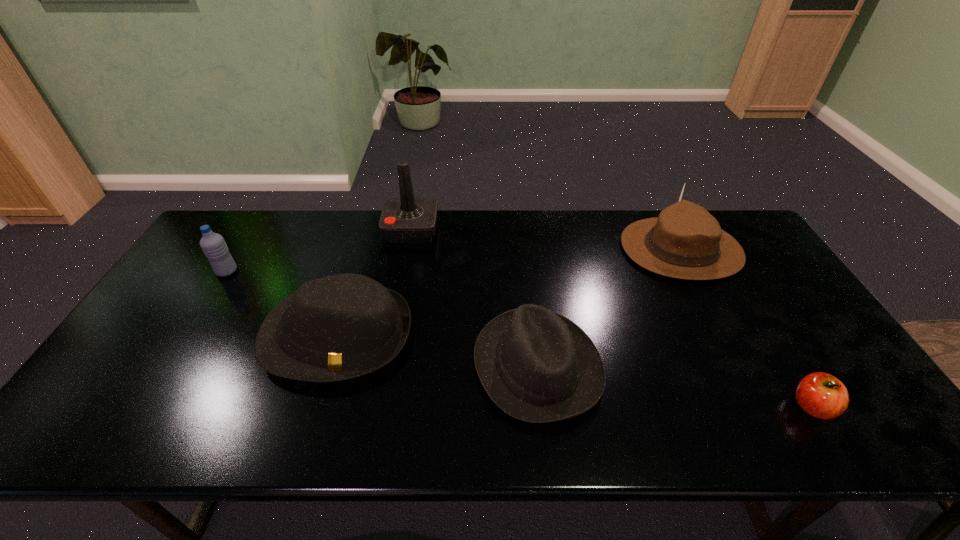
Where is `joystick`? joystick is located at coordinates (406, 219).

The width and height of the screenshot is (960, 540). What are the coordinates of `the farthest fedora` in the screenshot? It's located at (686, 242).

Locate an element on the screen. This screenshot has width=960, height=540. the leftmost object is located at coordinates (213, 245).

At what (x,y) coordinates should I click in order to perform the action: click on the leftmost fedora. Please return your answer as a coordinate pair (x, y). The image size is (960, 540). Looking at the image, I should click on (344, 326).

I want to click on the second fedora from left to right, so click(x=536, y=365).

You are a GUI agent. You are given a task and a screenshot of the screen. Output one action in this format:
    pyautogui.click(x=<x>, y=<y>)
    Task: Click on the second shortest object
    The image size is (960, 540).
    Given the screenshot: What is the action you would take?
    pyautogui.click(x=536, y=365)

Identify the location of apple. [821, 395].

At what (x,y) coordinates should I click in order to perform the action: click on vacant space located 0.050m on the left of the tallest object. Please return your answer as a coordinate pair (x, y). The image size is (960, 540). Looking at the image, I should click on (371, 230).

I want to click on blank space located on the feather side of the rightmost fedora, so click(x=597, y=249).

The width and height of the screenshot is (960, 540). In order to click on free spot located on the feather side of the rightmost fedora in this screenshot , I will do click(x=551, y=249).